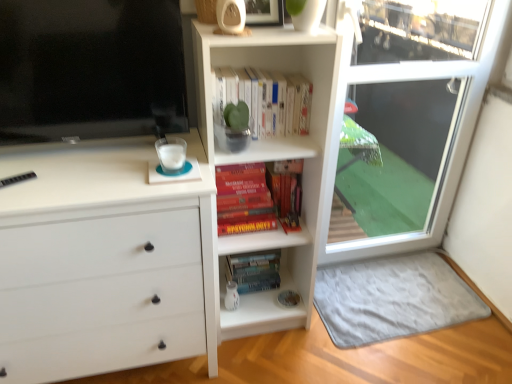
In order to face transparent glass screen door at right, should I rotate leftwards or rightwards?

It's best to rotate right around 18.673 degrees.

Locate an element on the screen. hardcover book at center is located at coordinates (254, 270).

Describe the element at coordinates (254, 270) in the screenshot. I see `hardcover book at center` at that location.

This screenshot has height=384, width=512. Describe the element at coordinates (262, 101) in the screenshot. I see `white matte book at upper center, which is counted as the second book, starting from the bottom` at that location.

What do you see at coordinates (392, 298) in the screenshot? I see `gray soft rug at lower right` at bounding box center [392, 298].

This screenshot has width=512, height=384. I want to click on hardcover books at center, the second book viewed from the top, so click(256, 199).

How many degrees apart are the facing directions of hardcover books at center, the second book viewed from the top, and white matte chest of drawers at left?

The angular difference between hardcover books at center, the second book viewed from the top, and white matte chest of drawers at left is 0.972 degrees.

Is hardcover books at center, acting as the first book starting from the bottom, oriented towards white matte chest of drawers at left?

No, hardcover books at center, acting as the first book starting from the bottom, is not oriented towards white matte chest of drawers at left.

From the picture: In terms of width, does hardcover books at center, the second book viewed from the top, look wider or thinner when compared to white matte chest of drawers at left?

hardcover books at center, the second book viewed from the top, is thinner than white matte chest of drawers at left.

From the picture: Which is more distant, (x=243, y=205) or (x=136, y=225)?

Positioned behind is point (x=243, y=205).

Based on the photo, considering the sizes of objects hardcover book at center and white matte book at upper center, which is counted as the second book, starting from the bottom, in the image provided, who is bigger, hardcover book at center or white matte book at upper center, which is counted as the second book, starting from the bottom,?

white matte book at upper center, which is counted as the second book, starting from the bottom.

Can you confirm if hardcover book at center is thinner than white matte book at upper center, which ranks as the 1th book in top-to-bottom order?

Indeed, hardcover book at center has a lesser width compared to white matte book at upper center, which ranks as the 1th book in top-to-bottom order.

Between point (262, 266) and point (242, 101), which one is positioned behind?

The point (262, 266) is farther from the camera.

Is hardcover book at center looking in the opposite direction of white matte book at upper center, which is counted as the second book, starting from the bottom?

hardcover book at center is not turned away from white matte book at upper center, which is counted as the second book, starting from the bottom.

Does white matte chest of drawers at left touch transparent glass screen door at right?

white matte chest of drawers at left and transparent glass screen door at right are not in contact.

Is white matte chest of drawers at left shorter than transparent glass screen door at right?

Correct, white matte chest of drawers at left is not as tall as transparent glass screen door at right.

The width and height of the screenshot is (512, 384). I want to click on the chest of drawers that is in front of the transparent glass screen door at right, so click(104, 261).

Which is farther, (x=22, y=150) or (x=391, y=218)?

The point (x=391, y=218) is farther.

Considering the relative positions of hardcover book at center and hardcover books at center, the second book viewed from the top, in the image provided, is hardcover book at center to the left of hardcover books at center, the second book viewed from the top, from the viewer's perspective?

No.

Is hardcover book at center positioned before hardcover books at center, the second book viewed from the top?

No, it is not.

Is hardcover book at center oriented away from hardcover books at center, the second book viewed from the top?

No, hardcover book at center is not facing away from hardcover books at center, the second book viewed from the top.

Is white matte chest of drawers at left wider than hardcover books at center, acting as the first book starting from the bottom?

Indeed, white matte chest of drawers at left has a greater width compared to hardcover books at center, acting as the first book starting from the bottom.

How many degrees apart are the facing directions of white matte chest of drawers at left and hardcover books at center, the second book viewed from the top?

0.972 degrees separate the facing orientations of white matte chest of drawers at left and hardcover books at center, the second book viewed from the top.

From a real-world perspective, which is physically above, white matte chest of drawers at left or hardcover books at center, the second book viewed from the top?

In real-world perspective, hardcover books at center, the second book viewed from the top, is above.

Looking at this image, from a real-world perspective, between white matte chest of drawers at left and flat screen tv at upper left, who is vertically higher?

flat screen tv at upper left, from a real-world perspective.

Who is taller, white matte chest of drawers at left or flat screen tv at upper left?

Standing taller between the two is white matte chest of drawers at left.

Which object is closer to the camera, white matte chest of drawers at left or flat screen tv at upper left?

white matte chest of drawers at left is closer to the camera.

From the picture: Considering the sizes of objects gray soft rug at lower right and flat screen tv at upper left in the image provided, who is thinner, gray soft rug at lower right or flat screen tv at upper left?

With smaller width is flat screen tv at upper left.

Is gray soft rug at lower right next to flat screen tv at upper left and touching it?

There is a gap between gray soft rug at lower right and flat screen tv at upper left.

From a real-world perspective, which is physically above, gray soft rug at lower right or flat screen tv at upper left?

flat screen tv at upper left is physically above.

The height and width of the screenshot is (384, 512). What are the coordinates of `blanket located underneath the flat screen tv at upper left (from a real-world perspective)` in the screenshot? It's located at point(392,298).

Where is `the 2nd book behind when counting from the white matte chest of drawers at left`? the 2nd book behind when counting from the white matte chest of drawers at left is located at coordinates (256, 199).

This screenshot has height=384, width=512. I want to click on book on the right of hardcover book at center, so click(262, 101).

From the picture: Looking at the image, which one is located further to flat screen tv at upper left, gray soft rug at lower right or white matte book at upper center, which ranks as the 1th book in top-to-bottom order?

Based on the image, gray soft rug at lower right appears to be further to flat screen tv at upper left.

Looking at this image, from the image, which object appears to be nearer to hardcover book at center, hardcover books at center, acting as the first book starting from the bottom, or flat screen tv at upper left?

hardcover books at center, acting as the first book starting from the bottom, is closer to hardcover book at center.

Looking at the image, which one is located closer to gray soft rug at lower right, hardcover book at center or white matte chest of drawers at left?

hardcover book at center is closer to gray soft rug at lower right.

Consider the image. Estimate the real-world distances between objects in this image. Which object is closer to white matte chest of drawers at left, hardcover book at center or gray soft rug at lower right?

Based on the image, hardcover book at center appears to be nearer to white matte chest of drawers at left.

In the scene shown: Based on their spatial positions, is white matte book at upper center, which is counted as the second book, starting from the bottom, or transparent glass screen door at right further from hardcover books at center, acting as the first book starting from the bottom?

transparent glass screen door at right is positioned further to the anchor hardcover books at center, acting as the first book starting from the bottom.

Considering their positions, is hardcover book at center positioned closer to white matte book at upper center, which ranks as the 1th book in top-to-bottom order, than transparent glass screen door at right?

The object closer to white matte book at upper center, which ranks as the 1th book in top-to-bottom order, is hardcover book at center.

Consider the image. From the image, which object appears to be farther from hardcover book at center, white matte book at upper center, which ranks as the 1th book in top-to-bottom order, or flat screen tv at upper left?

Among the two, flat screen tv at upper left is located further to hardcover book at center.

Which object lies nearer to the anchor point flat screen tv at upper left, gray soft rug at lower right or hardcover book at center?

Among the two, hardcover book at center is located nearer to flat screen tv at upper left.

Where is `screen door between white matte chest of drawers at left and gray soft rug at lower right`? Image resolution: width=512 pixels, height=384 pixels. screen door between white matte chest of drawers at left and gray soft rug at lower right is located at coordinates (409, 122).

I want to click on paperback book situated between hardcover books at center, acting as the first book starting from the bottom, and transparent glass screen door at right from left to right, so click(254, 270).

I want to click on television between white matte chest of drawers at left and hardcover book at center in the front-back direction, so click(x=90, y=69).

At what (x,y) coordinates should I click in order to perform the action: click on screen door between white matte book at upper center, which is counted as the second book, starting from the bottom, and gray soft rug at lower right in the up-down direction. Please return your answer as a coordinate pair (x, y). The width and height of the screenshot is (512, 384). Looking at the image, I should click on (409, 122).